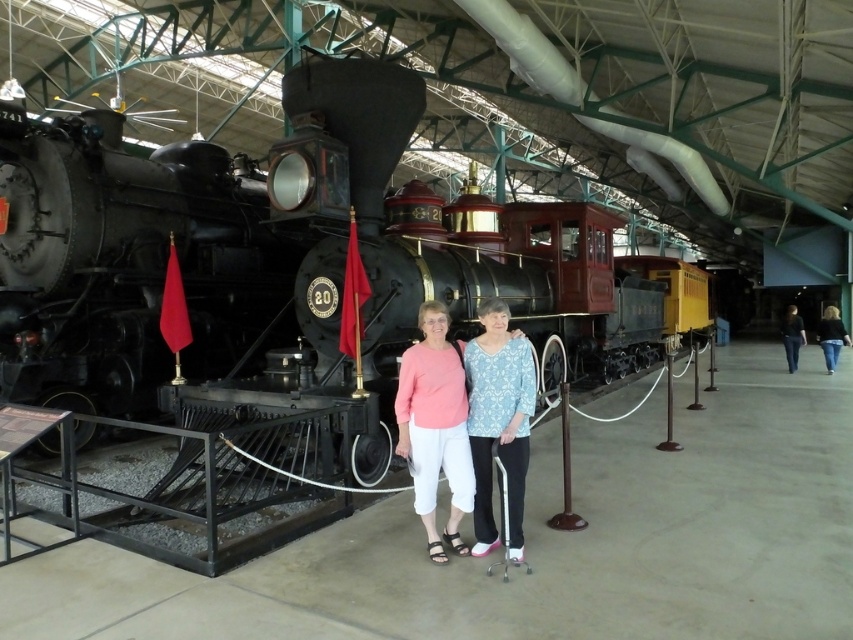
Is matte pink blouse at center positioned behind blue printed blouse at center?

That is True.

Does matte pink blouse at center have a lesser width compared to blue printed blouse at center?

No, matte pink blouse at center is not thinner than blue printed blouse at center.

Is point (425, 452) behind point (476, 481)?

No, (425, 452) is closer to viewer.

This screenshot has height=640, width=853. Identify the location of matte pink blouse at center. (436, 426).

Does polished black locomotive at center lie in front of polished black steam locomotive at left?

Yes, polished black locomotive at center is closer to the viewer.

Can you confirm if polished black locomotive at center is positioned above polished black steam locomotive at left?

No.

Is point (541, 211) farther from viewer compared to point (171, 234)?

That is True.

In order to click on polished black locomotive at center in this screenshot , I will do `click(296, 253)`.

Can you confirm if polished black steam locomotive at left is positioned to the left of jeans at right?

Correct, you'll find polished black steam locomotive at left to the left of jeans at right.

Based on the photo, who is more forward, (x=144, y=362) or (x=846, y=342)?

Point (x=144, y=362)

Find the location of a particular element. The width and height of the screenshot is (853, 640). polished black steam locomotive at left is located at coordinates (125, 262).